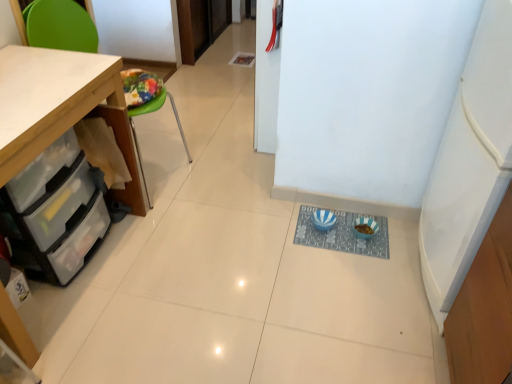
Locate an element on the screen. This screenshot has width=512, height=384. free space in front of blue striped bowls at center is located at coordinates (350, 286).